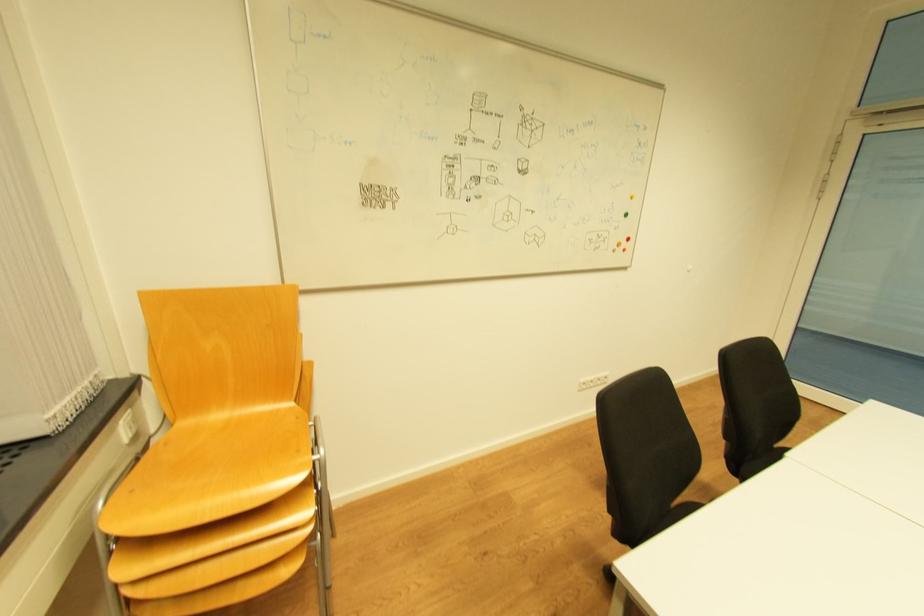
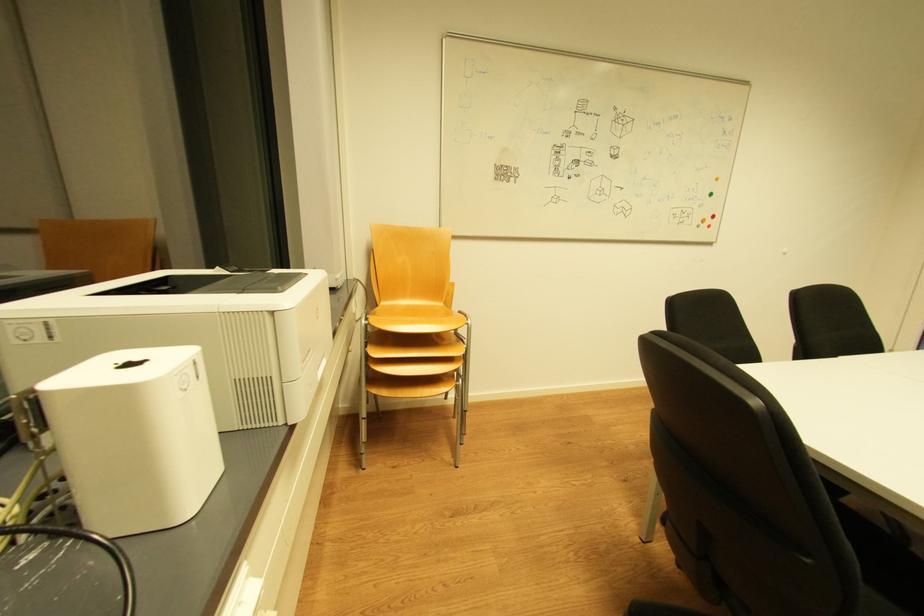
Question: The images are taken continuously from a first-person perspective. In which direction is your viewpoint rotating?

Choices:
 (A) Left
 (B) Right
 (C) Up
 (D) Down

Answer: (A)